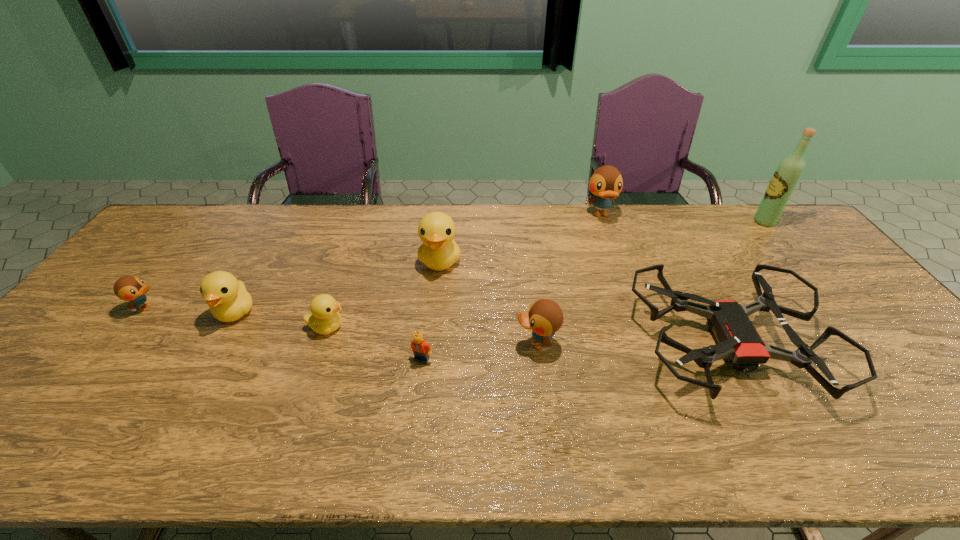
Locate an element on the screen. The width and height of the screenshot is (960, 540). vacant space located 0.150m on the front-facing side of the orange Lego is located at coordinates (415, 420).

Locate an element on the screen. The width and height of the screenshot is (960, 540). wine bottle located in the far edge section of the desktop is located at coordinates (787, 175).

This screenshot has height=540, width=960. Identify the location of object present at the left edge. (128, 288).

At what (x,y) coordinates should I click in order to perform the action: click on object that is at the right edge. Please return your answer as a coordinate pair (x, y). The height and width of the screenshot is (540, 960). Looking at the image, I should click on (787, 175).

Image resolution: width=960 pixels, height=540 pixels. I want to click on object that is at the far right corner, so click(x=787, y=175).

Find the location of a particular element. The width and height of the screenshot is (960, 540). free space at the far edge of the desktop is located at coordinates (581, 226).

This screenshot has height=540, width=960. I want to click on free space at the near edge, so click(450, 456).

The width and height of the screenshot is (960, 540). I want to click on vacant space at the right edge, so click(x=901, y=401).

This screenshot has width=960, height=540. I want to click on empty location between the rightmost object and the drone, so point(746,283).

Locate an element on the screen. The width and height of the screenshot is (960, 540). empty location between the third duck from right to left and the leftmost object is located at coordinates (293, 284).